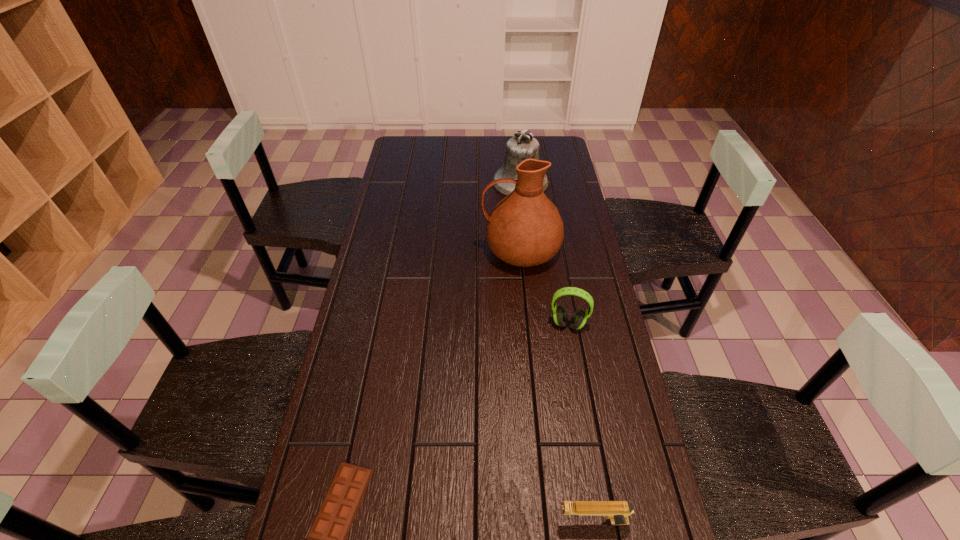
In order to click on blank area in the image that satisfies the following two spatial constraints: 1. on the side of the headset with the handle; 2. on the right side of the pitcher in this screenshot , I will do `click(527, 324)`.